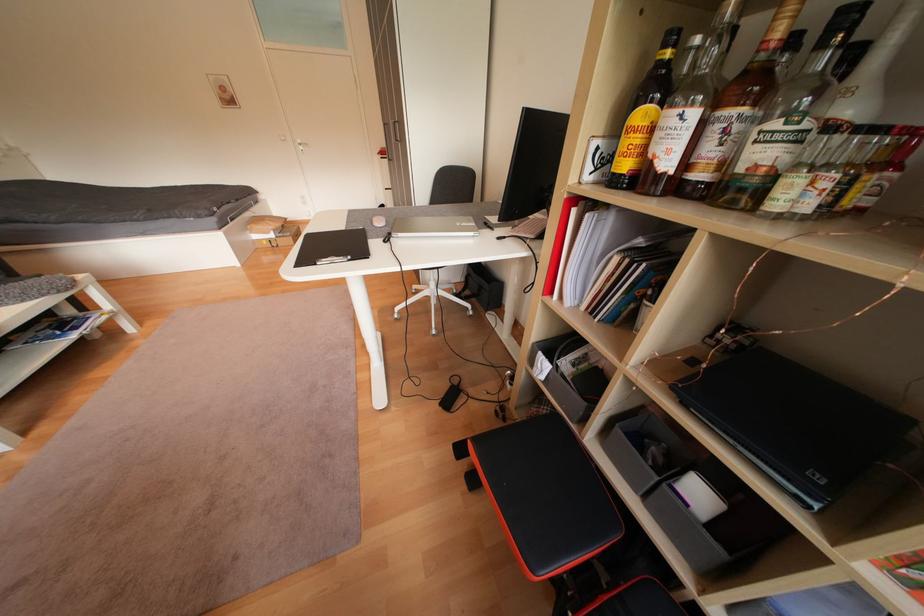
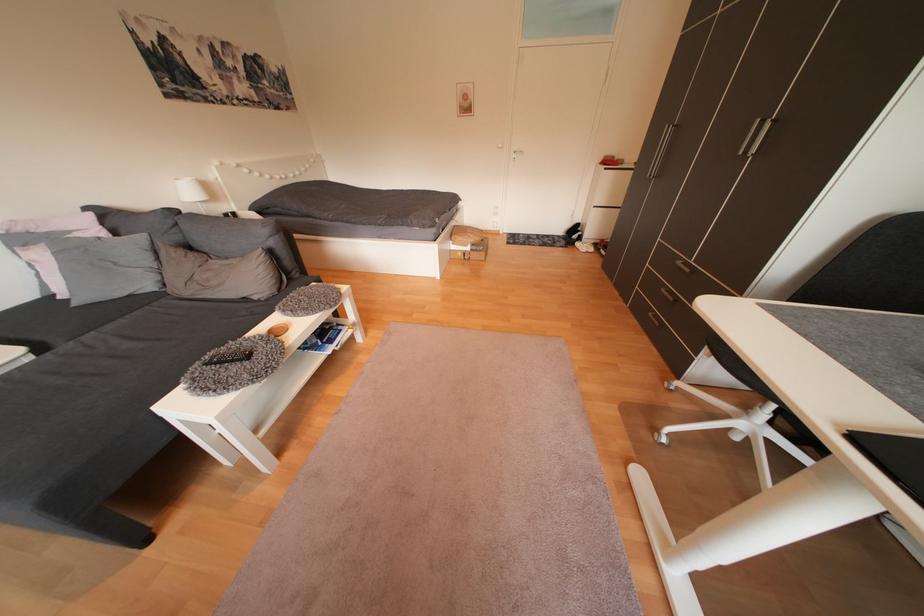
Which direction would the cameraman need to move to produce the second image?

The cameraman moved toward left, forward.